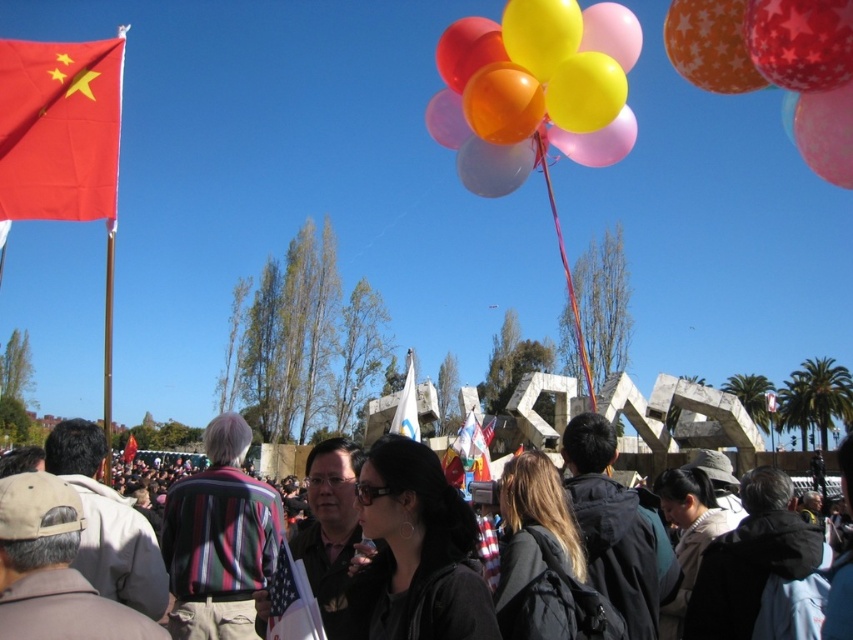
Question: Can you confirm if shiny metallic balloon at upper right is wider than american flag at center?

Choices:
 (A) no
 (B) yes

Answer: (B)

Question: Which object is positioned farthest from the black fabric crowd at center?

Choices:
 (A) orange star-patterned balloon at upper right
 (B) american flag at center
 (C) shiny metallic balloon at upper right

Answer: (A)

Question: In this image, where is glossy latex balloons at upper center located relative to black hair at center?

Choices:
 (A) below
 (B) above

Answer: (B)

Question: Which of the following is the farthest from the observer?

Choices:
 (A) (450, 449)
 (B) (387, 628)
 (C) (669, 51)
 (D) (250, 438)

Answer: (A)

Question: Which object is farther from the camera taking this photo?

Choices:
 (A) matte red flag at upper left
 (B) striped fabric shirt at center
 (C) red matte flag at upper left

Answer: (A)

Question: Does glossy latex balloons at upper center have a larger size compared to striped fabric shirt at center?

Choices:
 (A) no
 (B) yes

Answer: (B)